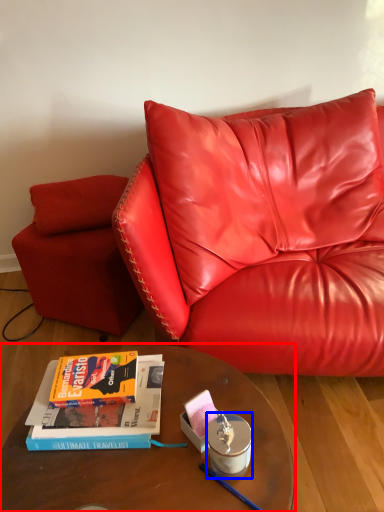
Question: Which of the following is the closest to the observer, table (highlighted by a red box) or candle holder (highlighted by a blue box)?

Choices:
 (A) table
 (B) candle holder

Answer: (A)